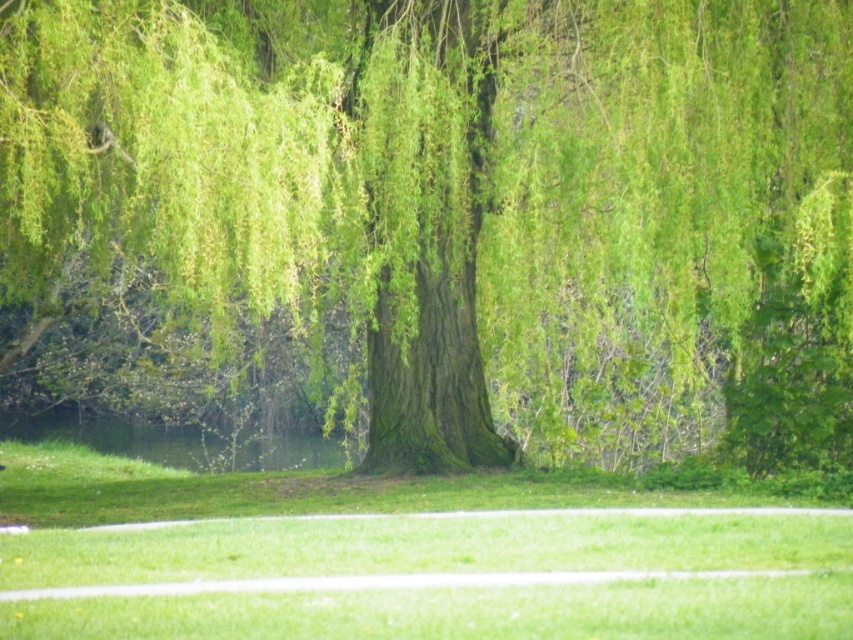
From the picture: Who is more forward, [264,193] or [555,516]?

Point [555,516] is more forward.

Which is below, green leafy willow at center or green grass at lower center?

Positioned lower is green grass at lower center.

Does point (762, 186) come closer to viewer compared to point (293, 525)?

That is False.

Find the location of `green leafy willow at center`. green leafy willow at center is located at coordinates (456, 211).